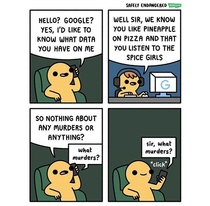
Find the location of a particular element. This screenshot has height=206, width=210. grey cartoon headphones is located at coordinates (117, 80), (142, 81).